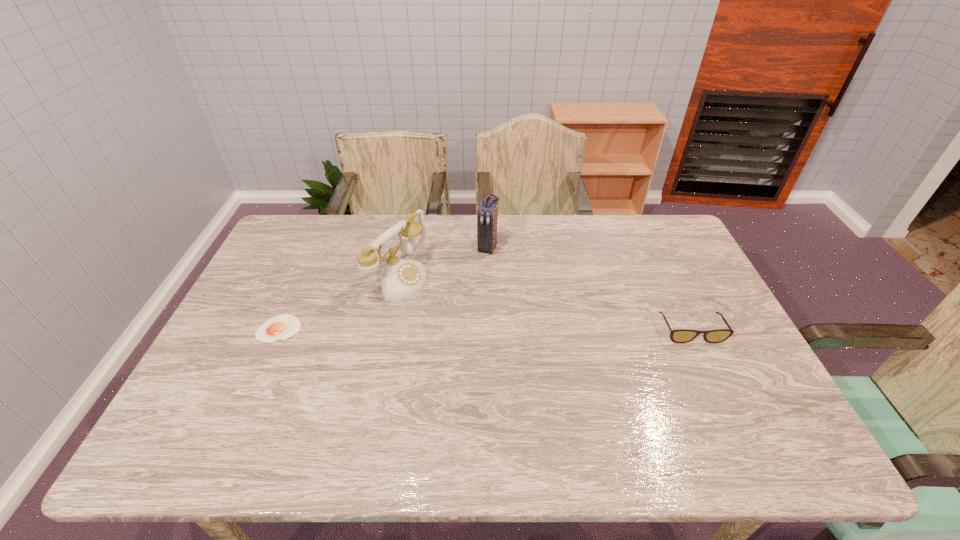
The width and height of the screenshot is (960, 540). What are the coordinates of `free space on the desktop that is between the egg yolk and the third tallest object and is positioned with the zip open on the second object from right to left` in the screenshot? It's located at (444, 329).

The width and height of the screenshot is (960, 540). I want to click on free space on the desktop that is between the leftmost object and the sunglasses and is positioned on the dial of the telephone, so click(x=518, y=329).